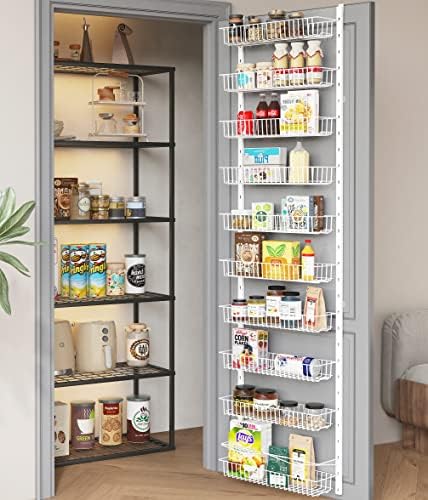
Locate an element on the screen. basket is located at coordinates (315, 485), (315, 415), (321, 364), (313, 317), (313, 266), (308, 223), (303, 185), (294, 130), (284, 81), (285, 32).